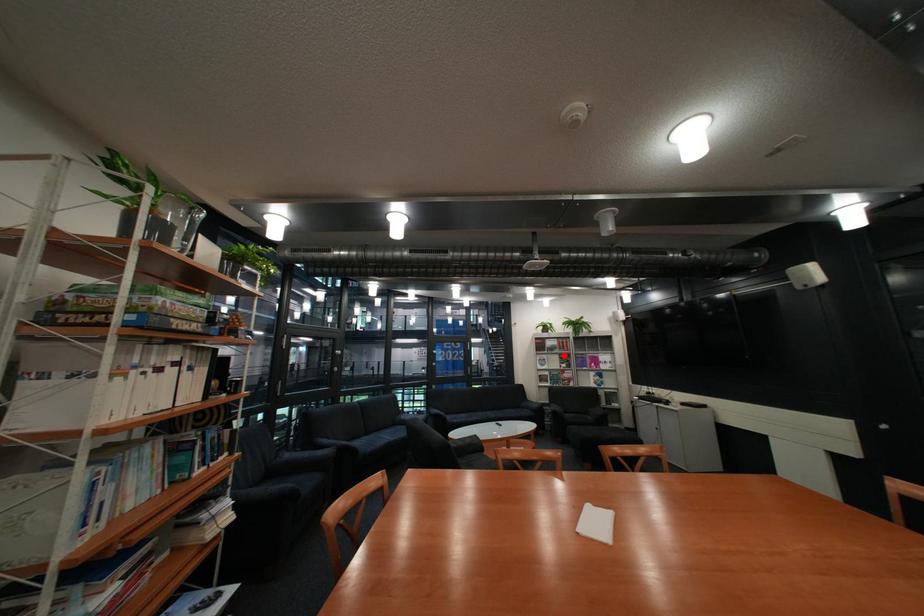
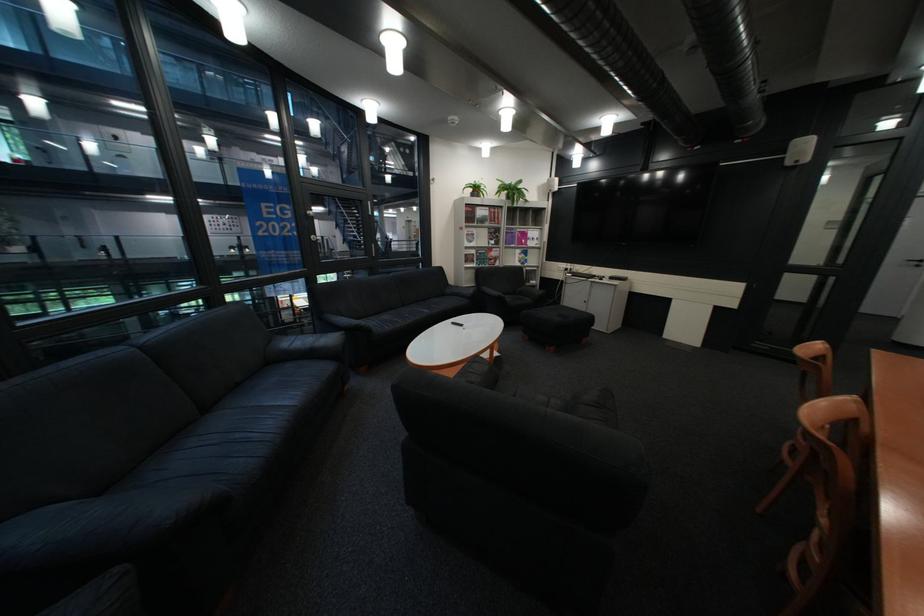
Where in the second image is the point corresponding to the highlighted location from the first image?

(492, 229)